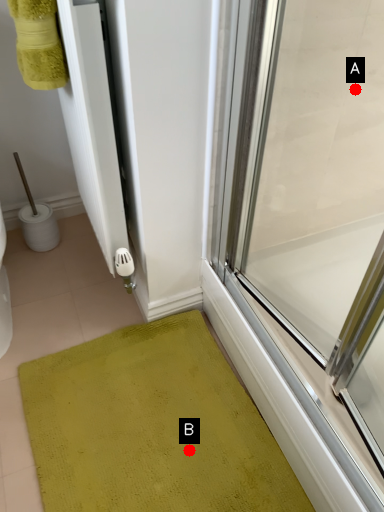
Question: Two points are circled on the image, labeled by A and B beside each circle. Which of the following is the closest to the observer?

Choices:
 (A) A is closer
 (B) B is closer

Answer: (A)